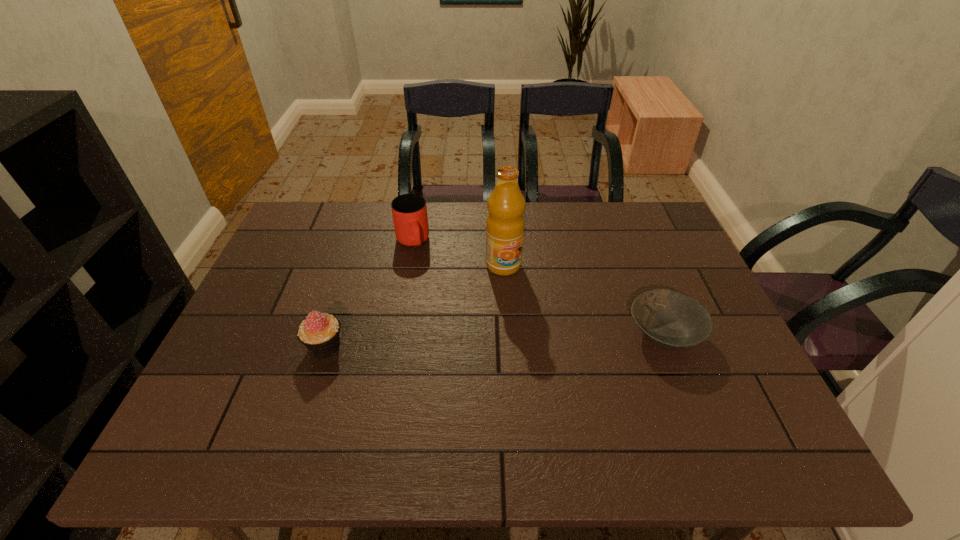
The height and width of the screenshot is (540, 960). I want to click on vacant space in between the cupcake and the cup, so click(369, 294).

Image resolution: width=960 pixels, height=540 pixels. Find the location of `empty location between the rightmost object and the cup`. empty location between the rightmost object and the cup is located at coordinates (539, 288).

At what (x,y) coordinates should I click in order to perform the action: click on free space between the leftmost object and the rightmost object. Please return your answer as a coordinate pair (x, y). This screenshot has height=540, width=960. Looking at the image, I should click on (494, 340).

Locate an element on the screen. This screenshot has width=960, height=540. vacant area that lies between the tallest object and the cup is located at coordinates (458, 253).

The image size is (960, 540). I want to click on empty space that is in between the third object from right to left and the fruit juice, so click(458, 253).

Locate an element on the screen. The height and width of the screenshot is (540, 960). empty space that is in between the fruit juice and the leftmost object is located at coordinates (415, 306).

I want to click on vacant space that is in between the rightmost object and the cup, so click(x=539, y=288).

Where is `free spot between the third object from right to left and the tallest object`? This screenshot has width=960, height=540. free spot between the third object from right to left and the tallest object is located at coordinates (458, 253).

Identify the location of vacant space that's between the leftmost object and the second object from left to right. (369, 294).

The height and width of the screenshot is (540, 960). What are the coordinates of `free area in between the second object from left to right and the rightmost object` in the screenshot? It's located at (539, 288).